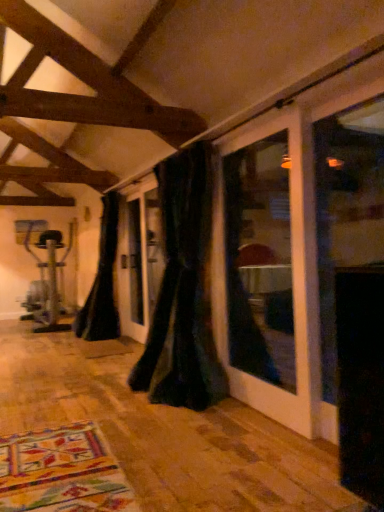
Image resolution: width=384 pixels, height=512 pixels. What do you see at coordinates (183, 291) in the screenshot?
I see `black velvet curtain at center, which appears as the first curtain when viewed from the front` at bounding box center [183, 291].

Where is `black velvet curtain at center, marked as the second curtain in a left-to-right arrangement`? The width and height of the screenshot is (384, 512). black velvet curtain at center, marked as the second curtain in a left-to-right arrangement is located at coordinates (183, 291).

This screenshot has height=512, width=384. What do you see at coordinates (102, 281) in the screenshot? I see `black velvet curtain at left, which is the 1th curtain in left-to-right order` at bounding box center [102, 281].

This screenshot has height=512, width=384. I want to click on black velvet curtain at left, which is the 1th curtain in left-to-right order, so click(102, 281).

The image size is (384, 512). I want to click on black velvet curtain at center, marked as the second curtain in a left-to-right arrangement, so click(x=183, y=291).

Does black velvet curtain at center, which appears as the first curtain when viewed from the front, appear on the left side of black velvet curtain at left, positioned as the second curtain in right-to-left order?

In fact, black velvet curtain at center, which appears as the first curtain when viewed from the front, is to the right of black velvet curtain at left, positioned as the second curtain in right-to-left order.

Between black velvet curtain at center, arranged as the first curtain when viewed from the right, and black velvet curtain at left, positioned as the second curtain in right-to-left order, which one is positioned behind?

Positioned behind is black velvet curtain at left, positioned as the second curtain in right-to-left order.

Does point (165, 217) lie behind point (101, 282)?

No, (165, 217) is closer to viewer.

From the image's perspective, which is above, black velvet curtain at center, which appears as the first curtain when viewed from the front, or black velvet curtain at left, marked as the first curtain in a back-to-front arrangement?

black velvet curtain at center, which appears as the first curtain when viewed from the front, is shown above in the image.

Looking at this image, from a real-world perspective, which is physically above, black velvet curtain at center, which ranks as the 2th curtain in back-to-front order, or black velvet curtain at left, marked as the first curtain in a back-to-front arrangement?

From a 3D spatial view, black velvet curtain at left, marked as the first curtain in a back-to-front arrangement, is above.

Considering the sizes of objects black velvet curtain at center, arranged as the first curtain when viewed from the right, and black velvet curtain at left, which is the 1th curtain in left-to-right order, in the image provided, who is thinner, black velvet curtain at center, arranged as the first curtain when viewed from the right, or black velvet curtain at left, which is the 1th curtain in left-to-right order,?

Thinner between the two is black velvet curtain at center, arranged as the first curtain when viewed from the right.

Considering the sizes of black velvet curtain at center, which ranks as the 2th curtain in back-to-front order, and black velvet curtain at left, the second curtain positioned from the front, in the image, is black velvet curtain at center, which ranks as the 2th curtain in back-to-front order, taller or shorter than black velvet curtain at left, the second curtain positioned from the front,?

Considering their sizes, black velvet curtain at center, which ranks as the 2th curtain in back-to-front order, has more height than black velvet curtain at left, the second curtain positioned from the front.

Consider the image. Which of these two, black velvet curtain at center, arranged as the first curtain when viewed from the right, or black velvet curtain at left, which is the 1th curtain in left-to-right order, is bigger?

Bigger between the two is black velvet curtain at left, which is the 1th curtain in left-to-right order.

Would you say black velvet curtain at left, marked as the first curtain in a back-to-front arrangement, is part of black velvet curtain at center, which ranks as the 2th curtain in back-to-front order,'s contents?

No.

Is black velvet curtain at center, which ranks as the 2th curtain in back-to-front order, directly adjacent to black velvet curtain at left, the second curtain positioned from the front?

No, black velvet curtain at center, which ranks as the 2th curtain in back-to-front order, is not making contact with black velvet curtain at left, the second curtain positioned from the front.

Is black velvet curtain at left, the second curtain positioned from the front, at the back of black velvet curtain at center, which ranks as the 2th curtain in back-to-front order?

No, black velvet curtain at center, which ranks as the 2th curtain in back-to-front order,'s orientation is not away from black velvet curtain at left, the second curtain positioned from the front.

Can you tell me how much black velvet curtain at center, marked as the second curtain in a left-to-right arrangement, and black velvet curtain at left, the second curtain positioned from the front, differ in facing direction?

0.000965 degrees separate the facing orientations of black velvet curtain at center, marked as the second curtain in a left-to-right arrangement, and black velvet curtain at left, the second curtain positioned from the front.

The height and width of the screenshot is (512, 384). I want to click on curtain that appears behind the black velvet curtain at center, which ranks as the 2th curtain in back-to-front order, so click(x=102, y=281).

Visually, is black velvet curtain at left, marked as the first curtain in a back-to-front arrangement, positioned to the left or to the right of black velvet curtain at center, which ranks as the 2th curtain in back-to-front order?

black velvet curtain at left, marked as the first curtain in a back-to-front arrangement, is positioned on black velvet curtain at center, which ranks as the 2th curtain in back-to-front order,'s left side.

Is the depth of black velvet curtain at left, positioned as the second curtain in right-to-left order, greater than that of black velvet curtain at center, arranged as the first curtain when viewed from the right?

That is True.

Which point is more forward, (93, 286) or (164, 364)?

The point (164, 364) is closer to the camera.

From the image's perspective, relative to black velvet curtain at center, arranged as the first curtain when viewed from the right, is black velvet curtain at left, marked as the first curtain in a back-to-front arrangement, above or below?

black velvet curtain at left, marked as the first curtain in a back-to-front arrangement, is situated lower than black velvet curtain at center, arranged as the first curtain when viewed from the right, in the image.

From a real-world perspective, is black velvet curtain at left, which is the 1th curtain in left-to-right order, on top of black velvet curtain at center, which appears as the first curtain when viewed from the front?

Correct, in the physical world, black velvet curtain at left, which is the 1th curtain in left-to-right order, is higher than black velvet curtain at center, which appears as the first curtain when viewed from the front.

Considering the sizes of objects black velvet curtain at left, the second curtain positioned from the front, and black velvet curtain at center, arranged as the first curtain when viewed from the right, in the image provided, who is wider, black velvet curtain at left, the second curtain positioned from the front, or black velvet curtain at center, arranged as the first curtain when viewed from the right,?

black velvet curtain at left, the second curtain positioned from the front.

Is black velvet curtain at left, positioned as the second curtain in right-to-left order, shorter than black velvet curtain at center, marked as the second curtain in a left-to-right arrangement?

Yes, black velvet curtain at left, positioned as the second curtain in right-to-left order, is shorter than black velvet curtain at center, marked as the second curtain in a left-to-right arrangement.

Considering the relative sizes of black velvet curtain at left, which is the 1th curtain in left-to-right order, and black velvet curtain at center, which ranks as the 2th curtain in back-to-front order, in the image provided, is black velvet curtain at left, which is the 1th curtain in left-to-right order, bigger than black velvet curtain at center, which ranks as the 2th curtain in back-to-front order,?

Indeed, black velvet curtain at left, which is the 1th curtain in left-to-right order, has a larger size compared to black velvet curtain at center, which ranks as the 2th curtain in back-to-front order.

Is black velvet curtain at center, which ranks as the 2th curtain in back-to-front order, located within black velvet curtain at left, positioned as the second curtain in right-to-left order?

Actually, black velvet curtain at center, which ranks as the 2th curtain in back-to-front order, is outside black velvet curtain at left, positioned as the second curtain in right-to-left order.

Are black velvet curtain at left, positioned as the second curtain in right-to-left order, and black velvet curtain at center, marked as the second curtain in a left-to-right arrangement, far apart?

Yes, black velvet curtain at left, positioned as the second curtain in right-to-left order, and black velvet curtain at center, marked as the second curtain in a left-to-right arrangement, are located far from each other.

Is black velvet curtain at left, marked as the first curtain in a back-to-front arrangement, turned away from black velvet curtain at center, which appears as the first curtain when viewed from the front?

black velvet curtain at left, marked as the first curtain in a back-to-front arrangement, is not turned away from black velvet curtain at center, which appears as the first curtain when viewed from the front.

Image resolution: width=384 pixels, height=512 pixels. What are the coordinates of `curtain below the black velvet curtain at center, arranged as the first curtain when viewed from the right (from the image's perspective)` in the screenshot? It's located at tap(102, 281).

This screenshot has height=512, width=384. In order to click on curtain directly beneath the black velvet curtain at left, positioned as the second curtain in right-to-left order (from a real-world perspective) in this screenshot , I will do `click(183, 291)`.

You are a GUI agent. You are given a task and a screenshot of the screen. Output one action in this format:
    pyautogui.click(x=<x>, y=<y>)
    Task: Click on the curtain behind the black velvet curtain at center, arranged as the first curtain when viewed from the right
    The width and height of the screenshot is (384, 512).
    Given the screenshot: What is the action you would take?
    pyautogui.click(x=102, y=281)